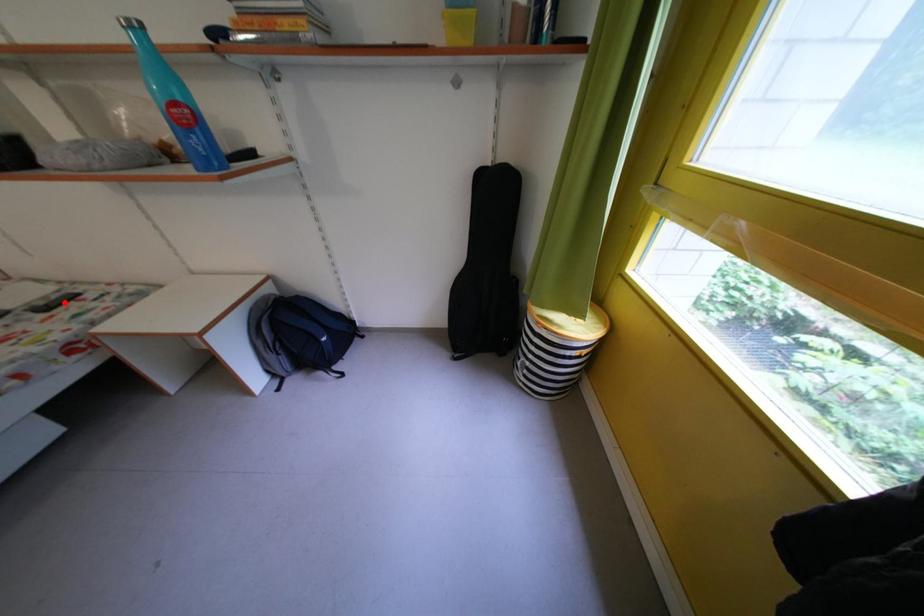
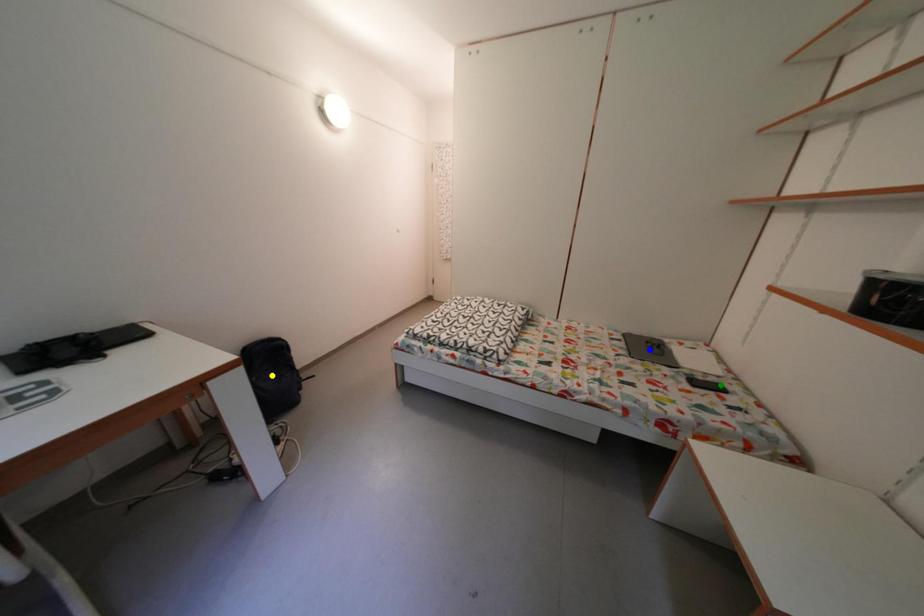
Question: I am providing you with two images of the same scene from different viewpoints. A red point is marked on the first image. You are given multiple points on the second image. In image 2, which mark is for the same physical point as the one in image 1?

Choices:
 (A) green point
 (B) yellow point
 (C) blue point

Answer: (A)